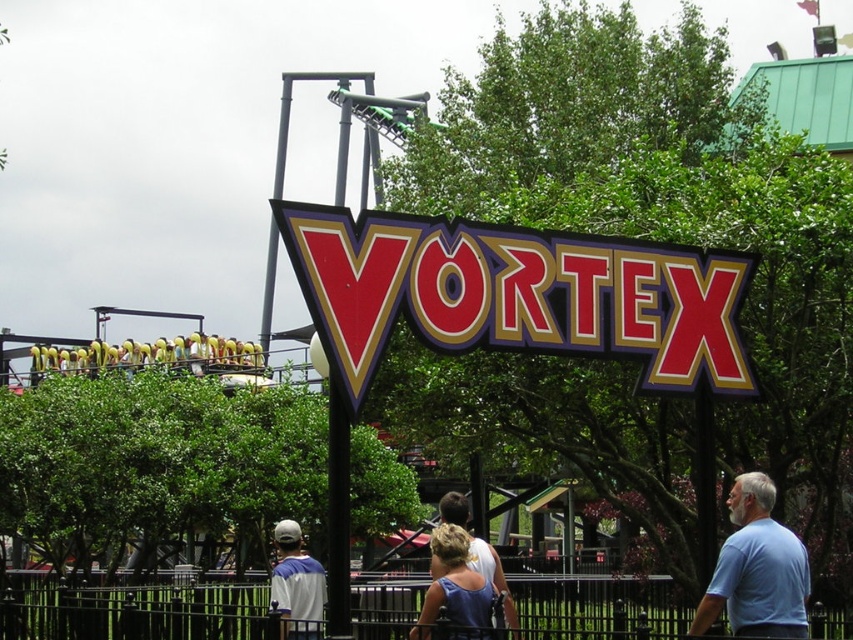
From the picture: You are a photographer trying to capture both the shiny red sign at center and the white jersey at lower left in a single frame. Which object should you focus on first to ensure both are in the frame?

Since the shiny red sign at center occupies less space than the white jersey at lower left, you should focus on the white jersey at lower left first to ensure both fit in the frame.

You are a park visitor trying to take a photo of the blue denim shirt at center without the black metal fence at lower center blocking the view. Can you move to the left to capture the shirt without the fence in the frame?

The black metal fence at lower center is wider than the blue denim shirt at center. Moving to the left might allow you to position yourself so that the fence is out of the frame while keeping the shirt visible, as the fence is wider and could be avoided by shifting sideways.